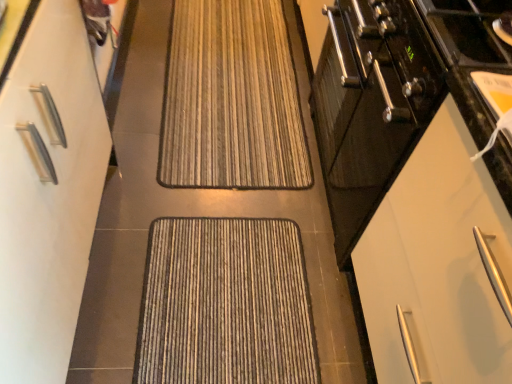
What do you see at coordinates (231, 100) in the screenshot? This screenshot has width=512, height=384. I see `brown striped mat at center, the second doormat positioned from the front` at bounding box center [231, 100].

This screenshot has width=512, height=384. What do you see at coordinates (437, 265) in the screenshot?
I see `white matte cabinet at right, the 1th cabinetry from the right` at bounding box center [437, 265].

Where is `white matte cabinet at left, marked as the 2th cabinetry in a right-to-left arrangement`? white matte cabinet at left, marked as the 2th cabinetry in a right-to-left arrangement is located at coordinates (48, 191).

Measure the distance between point (150, 244) and camera.

Point (150, 244) and camera are 5.10 feet apart.

Where is `textured brown doormat at center, which is the first doormat from front to back`? This screenshot has width=512, height=384. textured brown doormat at center, which is the first doormat from front to back is located at coordinates (225, 304).

Where is `brown striped mat at center, which appears as the first doormat when viewed from the back`? This screenshot has width=512, height=384. brown striped mat at center, which appears as the first doormat when viewed from the back is located at coordinates (231, 100).

From their relative heights in the image, would you say white matte cabinet at left, arranged as the 1th cabinetry when viewed from the left, is taller or shorter than white matte cabinet at right, the 1th cabinetry from the right?

Considering their sizes, white matte cabinet at left, arranged as the 1th cabinetry when viewed from the left, has more height than white matte cabinet at right, the 1th cabinetry from the right.

Could you measure the distance between white matte cabinet at left, marked as the 2th cabinetry in a right-to-left arrangement, and white matte cabinet at right, the 1th cabinetry from the right?

34.39 inches.

Is white matte cabinet at right, the 1th cabinetry from the right, surrounded by white matte cabinet at left, arranged as the 1th cabinetry when viewed from the left?

No, white matte cabinet at right, the 1th cabinetry from the right, is located outside of white matte cabinet at left, arranged as the 1th cabinetry when viewed from the left.

Image resolution: width=512 pixels, height=384 pixels. What are the coordinates of `cabinetry in front of the white matte cabinet at right, the 1th cabinetry from the right` in the screenshot? It's located at (48, 191).

In the scene shown: Can you tell me how much brown striped mat at center, the second doormat positioned from the front, and white matte cabinet at right, arranged as the 2th cabinetry when viewed from the left, differ in facing direction?

89.2 degrees separate the facing orientations of brown striped mat at center, the second doormat positioned from the front, and white matte cabinet at right, arranged as the 2th cabinetry when viewed from the left.

Is brown striped mat at center, which appears as the first doormat when viewed from the back, aimed at white matte cabinet at right, arranged as the 2th cabinetry when viewed from the left?

No, brown striped mat at center, which appears as the first doormat when viewed from the back, is not aimed at white matte cabinet at right, arranged as the 2th cabinetry when viewed from the left.

Between brown striped mat at center, the second doormat from the bottom, and white matte cabinet at right, arranged as the 2th cabinetry when viewed from the left, which one has larger size?

white matte cabinet at right, arranged as the 2th cabinetry when viewed from the left, is bigger.

From the white matte cabinet at right, arranged as the 2th cabinetry when viewed from the left, count 2nd doormats backward and point to it. Please provide its 2D coordinates.

[(231, 100)]

Is brown striped mat at center, arranged as the 1th doormat when viewed from the top, inside the boundaries of white matte cabinet at left, marked as the 2th cabinetry in a right-to-left arrangement, or outside?

brown striped mat at center, arranged as the 1th doormat when viewed from the top, lies outside white matte cabinet at left, marked as the 2th cabinetry in a right-to-left arrangement.

From the image's perspective, would you say brown striped mat at center, the second doormat from the bottom, is shown under white matte cabinet at left, arranged as the 1th cabinetry when viewed from the left?

No, from the image's perspective, brown striped mat at center, the second doormat from the bottom, is not below white matte cabinet at left, arranged as the 1th cabinetry when viewed from the left.

This screenshot has width=512, height=384. There is a white matte cabinet at left, marked as the 2th cabinetry in a right-to-left arrangement. In order to click on the 1st doormat below it (from a real-world perspective) in this screenshot , I will do `click(231, 100)`.

Which object is more forward, brown striped mat at center, the second doormat from the bottom, or white matte cabinet at left, marked as the 2th cabinetry in a right-to-left arrangement?

Positioned in front is white matte cabinet at left, marked as the 2th cabinetry in a right-to-left arrangement.

Considering the relative sizes of textured brown doormat at center, the first doormat positioned from the bottom, and white matte cabinet at left, arranged as the 1th cabinetry when viewed from the left, in the image provided, is textured brown doormat at center, the first doormat positioned from the bottom, smaller than white matte cabinet at left, arranged as the 1th cabinetry when viewed from the left,?

Indeed, textured brown doormat at center, the first doormat positioned from the bottom, has a smaller size compared to white matte cabinet at left, arranged as the 1th cabinetry when viewed from the left.

Is white matte cabinet at left, marked as the 2th cabinetry in a right-to-left arrangement, surrounded by textured brown doormat at center, the second doormat positioned from the top?

No, white matte cabinet at left, marked as the 2th cabinetry in a right-to-left arrangement, is located outside of textured brown doormat at center, the second doormat positioned from the top.

Which object is thinner, textured brown doormat at center, the first doormat positioned from the bottom, or white matte cabinet at left, arranged as the 1th cabinetry when viewed from the left?

white matte cabinet at left, arranged as the 1th cabinetry when viewed from the left, is thinner.

Based on the photo, between brown striped mat at center, the second doormat positioned from the front, and textured brown doormat at center, the first doormat positioned from the bottom, which one has larger width?

With larger width is brown striped mat at center, the second doormat positioned from the front.

Is point (182, 0) in front of point (243, 318)?

No, (182, 0) is further to viewer.

Which object is positioned more to the left, brown striped mat at center, which appears as the first doormat when viewed from the back, or textured brown doormat at center, the second doormat positioned from the top?

brown striped mat at center, which appears as the first doormat when viewed from the back.

Considering the relative sizes of white matte cabinet at left, marked as the 2th cabinetry in a right-to-left arrangement, and textured brown doormat at center, acting as the 2th doormat starting from the back, in the image provided, is white matte cabinet at left, marked as the 2th cabinetry in a right-to-left arrangement, thinner than textured brown doormat at center, acting as the 2th doormat starting from the back,?

Indeed, white matte cabinet at left, marked as the 2th cabinetry in a right-to-left arrangement, has a lesser width compared to textured brown doormat at center, acting as the 2th doormat starting from the back.

Is textured brown doormat at center, the second doormat positioned from the top, at the back of white matte cabinet at left, arranged as the 1th cabinetry when viewed from the left?

That's not correct — white matte cabinet at left, arranged as the 1th cabinetry when viewed from the left, is not looking away from textured brown doormat at center, the second doormat positioned from the top.

Can you confirm if white matte cabinet at left, arranged as the 1th cabinetry when viewed from the left, is taller than textured brown doormat at center, the first doormat positioned from the bottom?

Yes.

From a real-world perspective, does white matte cabinet at left, arranged as the 1th cabinetry when viewed from the left, stand above textured brown doormat at center, which is the first doormat from front to back?

Yes, from a real-world perspective, white matte cabinet at left, arranged as the 1th cabinetry when viewed from the left, is over textured brown doormat at center, which is the first doormat from front to back

From a real-world perspective, who is located higher, white matte cabinet at right, arranged as the 2th cabinetry when viewed from the left, or brown striped mat at center, the second doormat positioned from the front?

In real-world perspective, white matte cabinet at right, arranged as the 2th cabinetry when viewed from the left, is above.

Does point (392, 365) appear closer or farther from the camera than point (194, 49)?

Clearly, point (392, 365) is closer to the camera than point (194, 49).

Does white matte cabinet at right, the 1th cabinetry from the right, appear on the right side of brown striped mat at center, the second doormat from the bottom?

Yes, white matte cabinet at right, the 1th cabinetry from the right, is to the right of brown striped mat at center, the second doormat from the bottom.

Considering the sizes of objects white matte cabinet at right, arranged as the 2th cabinetry when viewed from the left, and brown striped mat at center, the second doormat positioned from the front, in the image provided, who is wider, white matte cabinet at right, arranged as the 2th cabinetry when viewed from the left, or brown striped mat at center, the second doormat positioned from the front,?

Wider between the two is brown striped mat at center, the second doormat positioned from the front.

The width and height of the screenshot is (512, 384). What are the coordinates of `cabinetry located in front of the white matte cabinet at right, arranged as the 2th cabinetry when viewed from the left` in the screenshot? It's located at (48, 191).

Locate an element on the screen. The width and height of the screenshot is (512, 384). doormat that is the 1st object directly below the white matte cabinet at right, the 1th cabinetry from the right (from a real-world perspective) is located at coordinates 231,100.

Which object lies further to the anchor point brown striped mat at center, arranged as the 1th doormat when viewed from the top, textured brown doormat at center, the first doormat positioned from the bottom, or white matte cabinet at left, marked as the 2th cabinetry in a right-to-left arrangement?

white matte cabinet at left, marked as the 2th cabinetry in a right-to-left arrangement, is positioned further to the anchor brown striped mat at center, arranged as the 1th doormat when viewed from the top.

When comparing their distances from white matte cabinet at right, arranged as the 2th cabinetry when viewed from the left, does textured brown doormat at center, which is the first doormat from front to back, or brown striped mat at center, arranged as the 1th doormat when viewed from the top, seem further?

The object further to white matte cabinet at right, arranged as the 2th cabinetry when viewed from the left, is brown striped mat at center, arranged as the 1th doormat when viewed from the top.

When comparing their distances from white matte cabinet at left, arranged as the 1th cabinetry when viewed from the left, does white matte cabinet at right, the 1th cabinetry from the right, or textured brown doormat at center, which is the first doormat from front to back, seem further?

The object further to white matte cabinet at left, arranged as the 1th cabinetry when viewed from the left, is white matte cabinet at right, the 1th cabinetry from the right.

From the image, which object appears to be farther from white matte cabinet at right, arranged as the 2th cabinetry when viewed from the left, white matte cabinet at left, marked as the 2th cabinetry in a right-to-left arrangement, or textured brown doormat at center, the second doormat positioned from the top?

white matte cabinet at left, marked as the 2th cabinetry in a right-to-left arrangement.

Considering their positions, is textured brown doormat at center, which is the first doormat from front to back, positioned closer to white matte cabinet at left, marked as the 2th cabinetry in a right-to-left arrangement, than white matte cabinet at right, arranged as the 2th cabinetry when viewed from the left?

textured brown doormat at center, which is the first doormat from front to back.

Consider the image. When comparing their distances from white matte cabinet at right, the 1th cabinetry from the right, does white matte cabinet at left, arranged as the 1th cabinetry when viewed from the left, or brown striped mat at center, the second doormat positioned from the front, seem further?

The object further to white matte cabinet at right, the 1th cabinetry from the right, is brown striped mat at center, the second doormat positioned from the front.

Estimate the real-world distances between objects in this image. Which object is further from textured brown doormat at center, which is the first doormat from front to back, white matte cabinet at right, arranged as the 2th cabinetry when viewed from the left, or brown striped mat at center, the second doormat from the bottom?

The object further to textured brown doormat at center, which is the first doormat from front to back, is brown striped mat at center, the second doormat from the bottom.

From the picture: When comparing their distances from white matte cabinet at left, marked as the 2th cabinetry in a right-to-left arrangement, does white matte cabinet at right, arranged as the 2th cabinetry when viewed from the left, or brown striped mat at center, the second doormat from the bottom, seem further?

white matte cabinet at right, arranged as the 2th cabinetry when viewed from the left, is further to white matte cabinet at left, marked as the 2th cabinetry in a right-to-left arrangement.

Image resolution: width=512 pixels, height=384 pixels. What are the coordinates of `doormat between white matte cabinet at right, the 1th cabinetry from the right, and brown striped mat at center, the second doormat positioned from the front, in the front-back direction` in the screenshot? It's located at (225, 304).

Find the location of a particular element. This screenshot has height=384, width=512. cabinetry between white matte cabinet at left, marked as the 2th cabinetry in a right-to-left arrangement, and brown striped mat at center, the second doormat from the bottom, in the front-back direction is located at coordinates (437, 265).

The width and height of the screenshot is (512, 384). I want to click on doormat located between white matte cabinet at left, marked as the 2th cabinetry in a right-to-left arrangement, and brown striped mat at center, which appears as the first doormat when viewed from the back, in the depth direction, so click(225, 304).